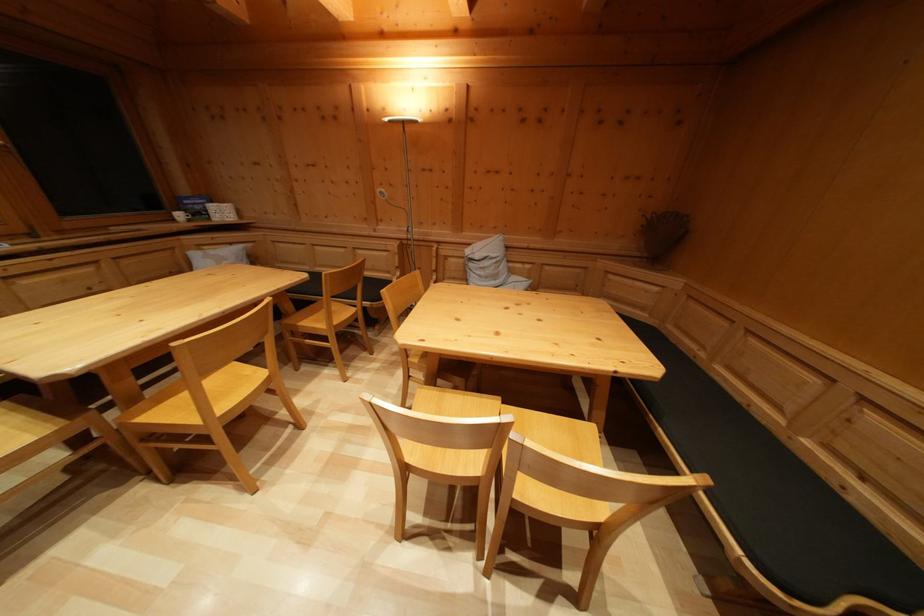
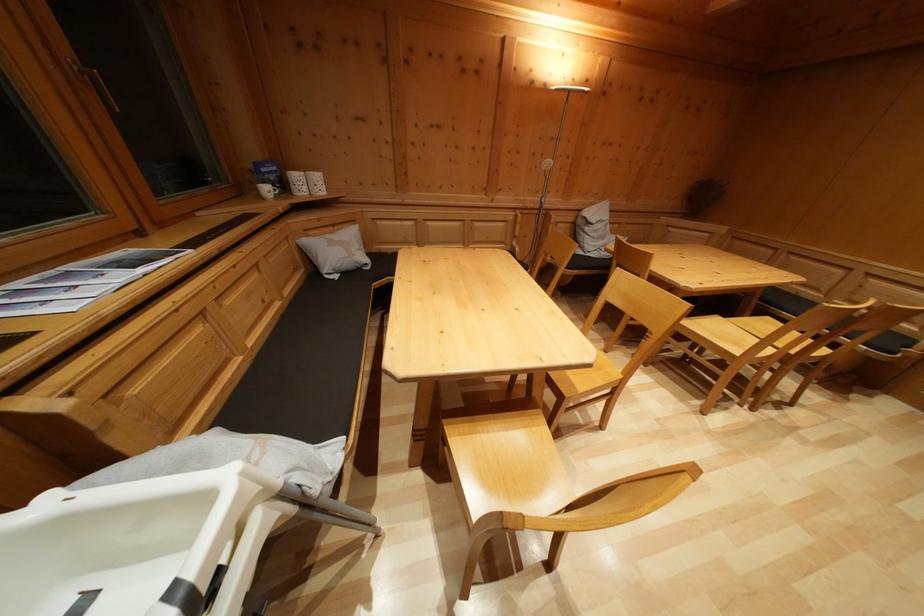
Find the pixel in the second image that matches (x=186, y=223) in the first image.

(273, 197)